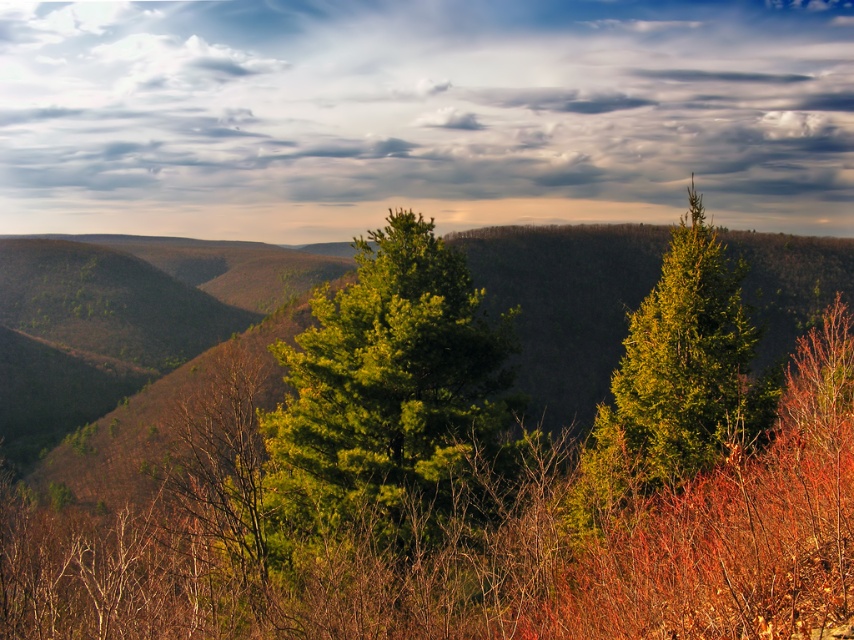
Question: Can you confirm if green needle-like at center is bigger than green glossy tree at upper right?

Choices:
 (A) yes
 (B) no

Answer: (A)

Question: Which object appears closest to the camera in this image?

Choices:
 (A) green needle-like at center
 (B) green glossy tree at upper right

Answer: (B)

Question: Among these objects, which one is farthest from the camera?

Choices:
 (A) cloudy sky at upper center
 (B) green glossy tree at upper right

Answer: (A)

Question: Is cloudy sky at upper center to the right of green needle-like at center from the viewer's perspective?

Choices:
 (A) no
 (B) yes

Answer: (A)

Question: Which of the following is the farthest from the observer?

Choices:
 (A) cloudy sky at upper center
 (B) green needle-like at center
 (C) green glossy tree at upper right

Answer: (A)

Question: From the image, what is the correct spatial relationship of green needle-like at center in relation to green glossy tree at upper right?

Choices:
 (A) above
 (B) below

Answer: (B)